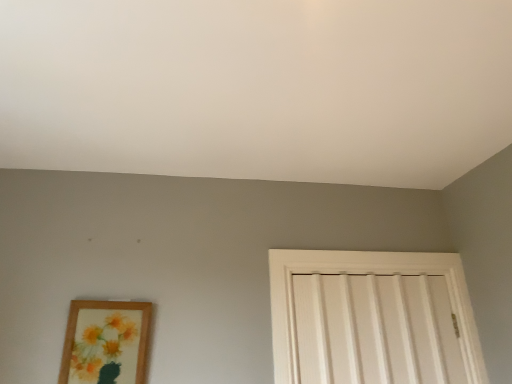
What are the coordinates of `wooden picture frame at lower left` in the screenshot? It's located at (106, 342).

Measure the distance between wooden picture frame at lower left and camera.

The distance of wooden picture frame at lower left from camera is 1.55 meters.

This screenshot has height=384, width=512. Describe the element at coordinates (106, 342) in the screenshot. I see `wooden picture frame at lower left` at that location.

The width and height of the screenshot is (512, 384). Identify the location of wooden picture frame at lower left. (106, 342).